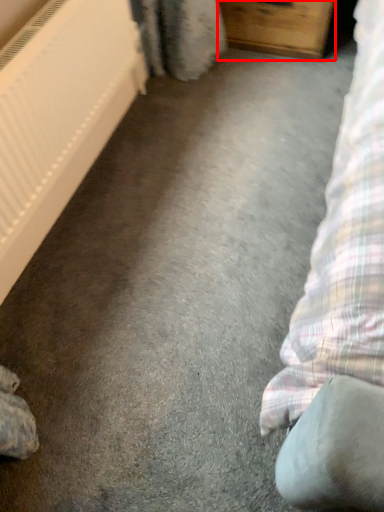
Question: From the image's perspective, where is furniture (annotated by the red box) located relative to radiator?

Choices:
 (A) below
 (B) above

Answer: (B)